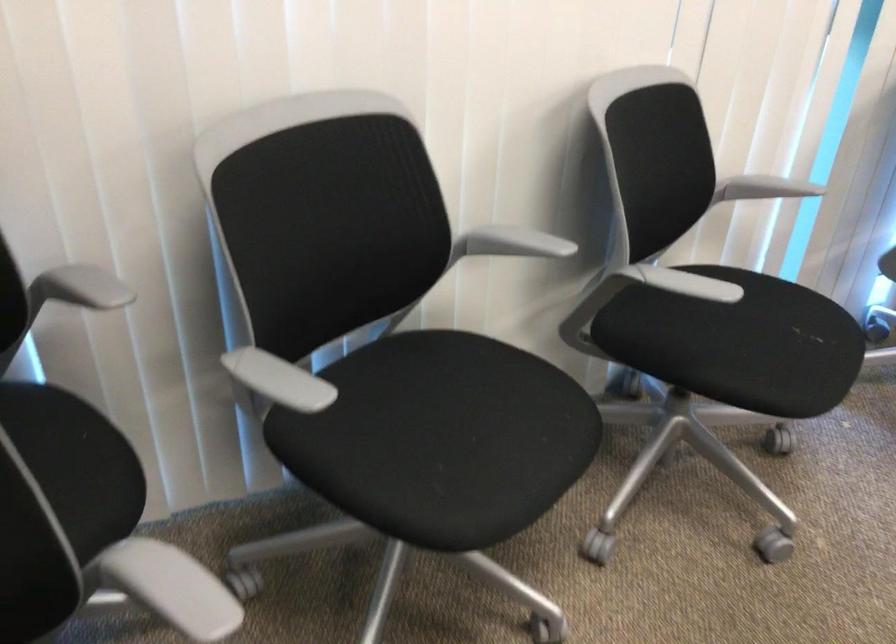
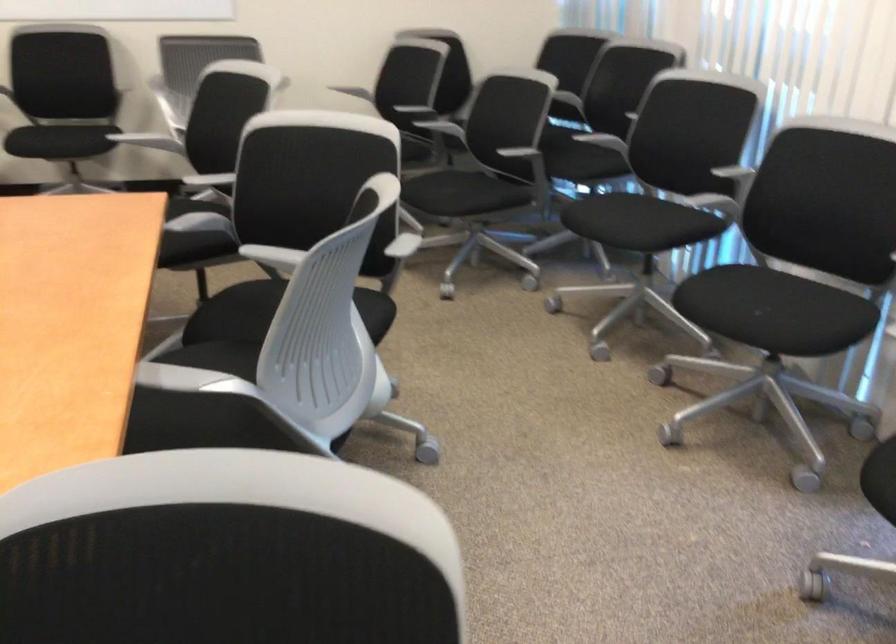
Find the pixel in the second image that matches pixel 784 317 in the first image.

(771, 310)